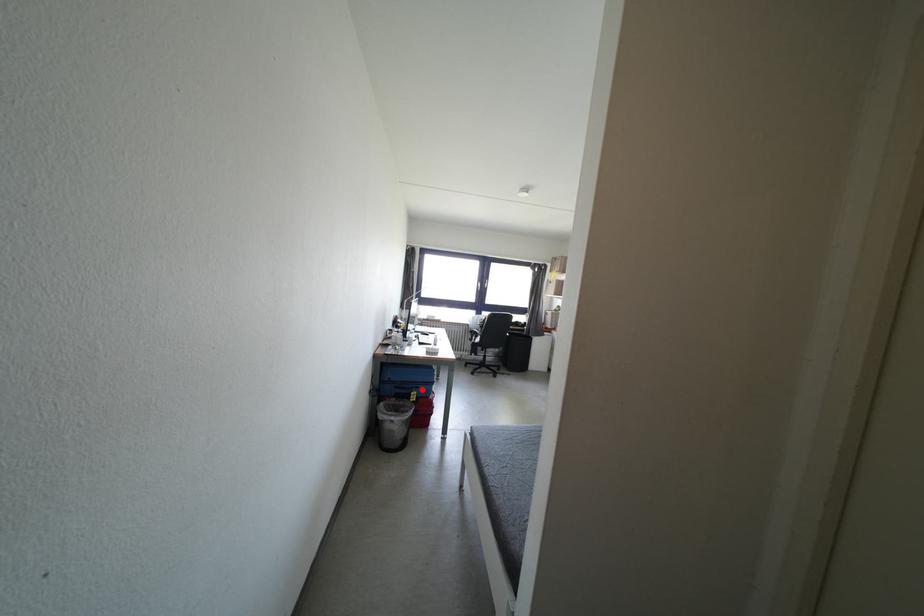
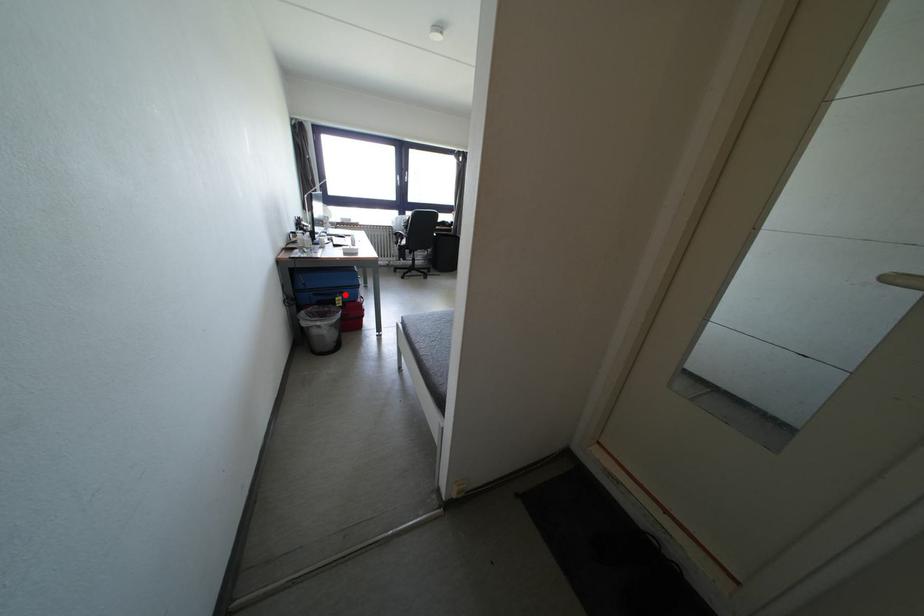
I am providing you with two images of the same scene from different viewpoints. A red point is marked on the first image and another point is marked on the second image. Do the highlighted points in image1 and image2 indicate the same real-world spot?

Yes